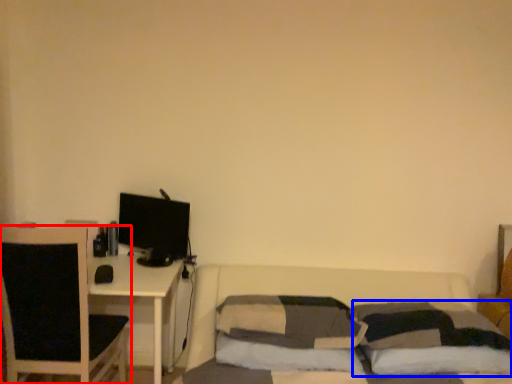
Question: Which point is further to the camera, chair (highlighted by a red box) or pillow (highlighted by a blue box)?

Choices:
 (A) chair
 (B) pillow

Answer: (A)